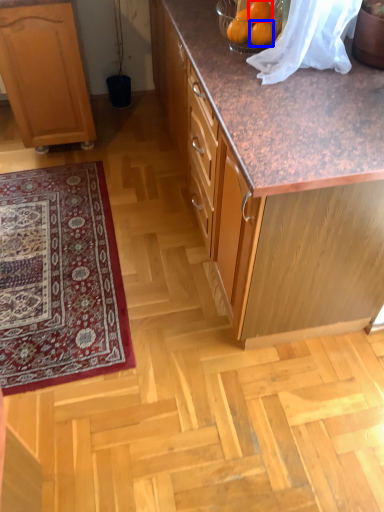
Question: Which of the following is the closest to the observer, orange (highlighted by a red box) or orange (highlighted by a blue box)?

Choices:
 (A) orange
 (B) orange

Answer: (B)